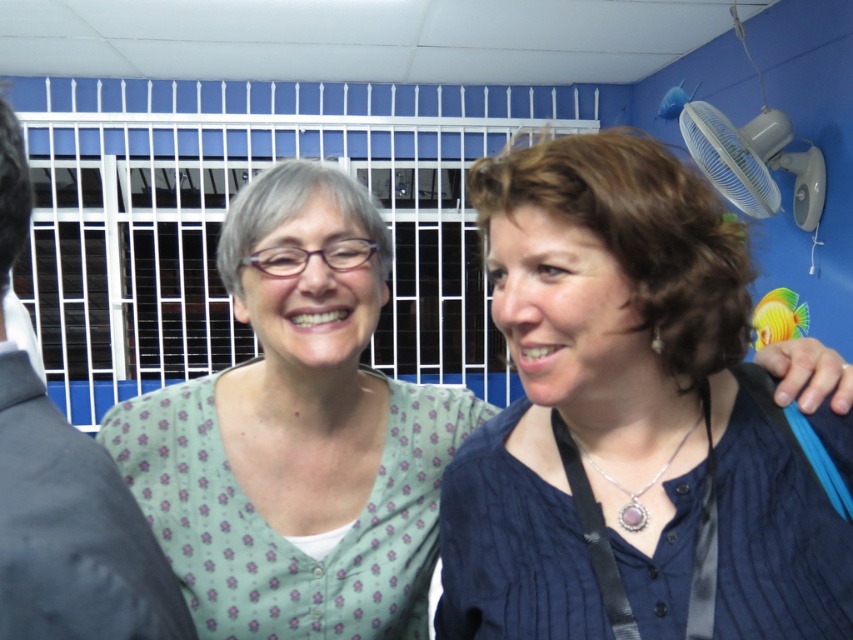
Question: Is blue textured blouse at center above white plastic fan at upper right?

Choices:
 (A) no
 (B) yes

Answer: (A)

Question: Is blue textured blouse at center below gray matte hair at center?

Choices:
 (A) yes
 (B) no

Answer: (A)

Question: Among these points, which one is nearest to the camera?

Choices:
 (A) (265, 220)
 (B) (15, 148)
 (C) (805, 221)

Answer: (B)

Question: Estimate the real-world distances between objects in this image. Which object is closer to the blue textured blouse at center?

Choices:
 (A) gray matte hair at center
 (B) brown matte hair at center
 (C) light green floral shirt at center
 (D) white plastic fan at upper right

Answer: (B)

Question: From the image, what is the correct spatial relationship of light green floral shirt at center in relation to white plastic fan at upper right?

Choices:
 (A) left
 (B) right

Answer: (A)

Question: Based on their relative distances, which object is farther from the light green floral shirt at center?

Choices:
 (A) white plastic fan at upper right
 (B) black matte hair at left
 (C) brown matte hair at center

Answer: (A)